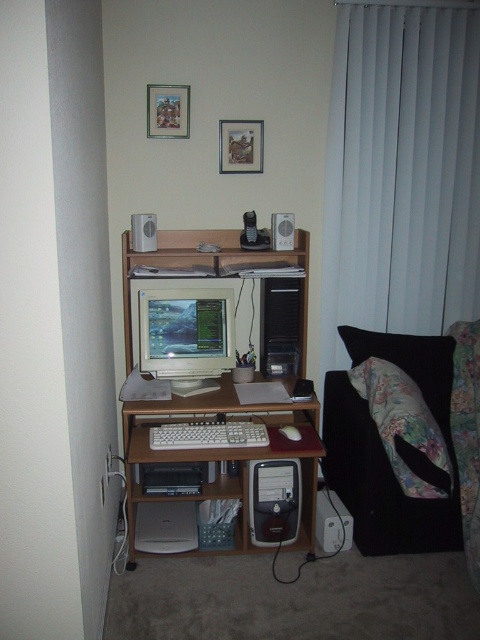
Question: Can you confirm if white vertical blinds at right is positioned below white plastic keyboard at center?

Choices:
 (A) no
 (B) yes

Answer: (A)

Question: Which point is closer to the camera?

Choices:
 (A) (245, 433)
 (B) (296, 484)

Answer: (A)

Question: Is matte wood computer desk at center in front of white matte mouse at center?

Choices:
 (A) yes
 (B) no

Answer: (A)

Question: Which point is farther to the camera?

Choices:
 (A) matte plastic speaker at upper center
 (B) matte silver monitor at center
 (C) white plastic speaker at upper center

Answer: (A)

Question: Where is white plastic keyboard at center located in relation to matte plastic speaker at upper center in the image?

Choices:
 (A) below
 (B) above

Answer: (A)

Question: Based on their relative distances, which object is nearer to the black plastic computer tower at lower center?

Choices:
 (A) matte silver monitor at center
 (B) white matte mouse at center

Answer: (B)